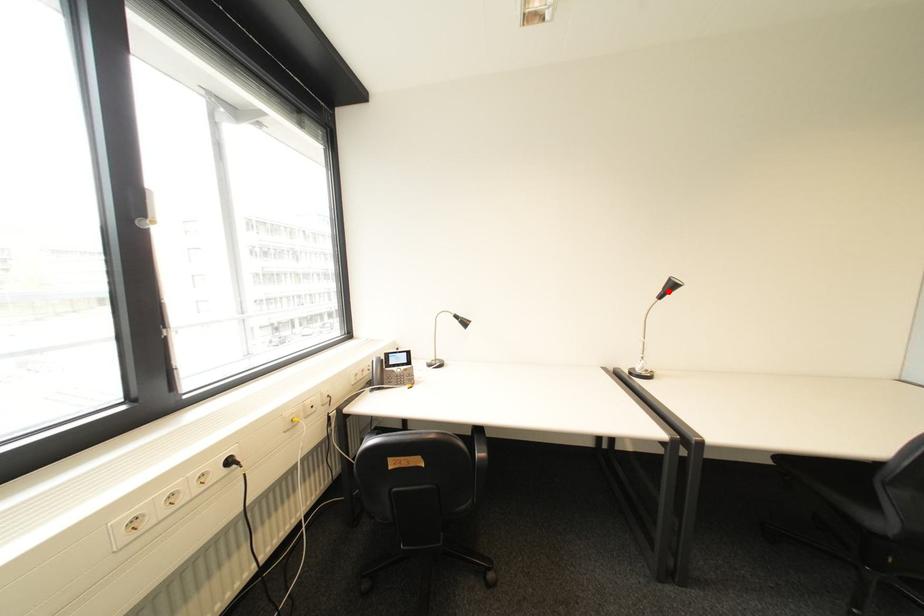
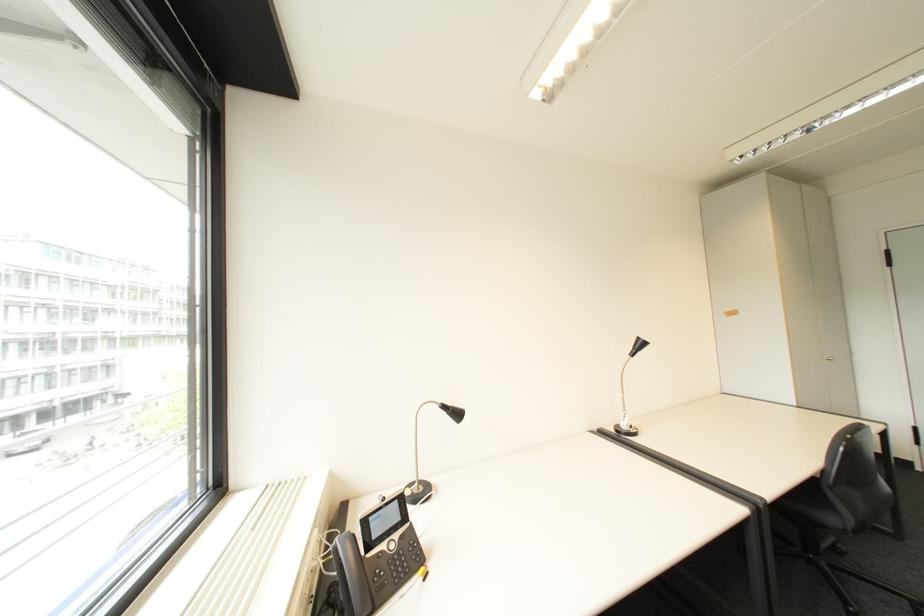
The point at the highlighted location is marked in the first image. Where is the corresponding point in the second image?

(640, 350)